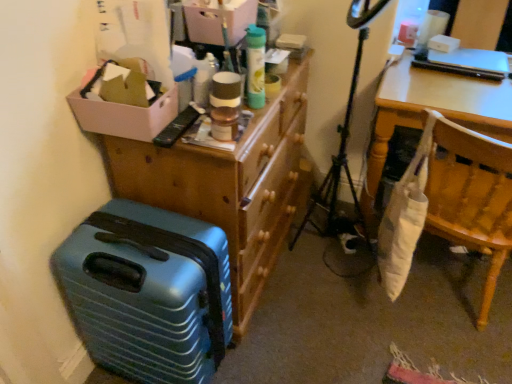
Question: Is wooden dresser at upper center smaller than matte cardboard box at upper center?

Choices:
 (A) yes
 (B) no

Answer: (B)

Question: Can you confirm if wooden dresser at upper center is shorter than matte cardboard box at upper center?

Choices:
 (A) no
 (B) yes

Answer: (A)

Question: Is there a large distance between wooden dresser at upper center and matte cardboard box at upper center?

Choices:
 (A) yes
 (B) no

Answer: (B)

Question: Is wooden dresser at upper center taller than matte cardboard box at upper center?

Choices:
 (A) yes
 (B) no

Answer: (A)

Question: From the image's perspective, is wooden dresser at upper center beneath matte cardboard box at upper center?

Choices:
 (A) yes
 (B) no

Answer: (A)

Question: Considering the positions of white fabric bag at right and white cardboard box at upper left in the image, is white fabric bag at right bigger or smaller than white cardboard box at upper left?

Choices:
 (A) small
 (B) big

Answer: (B)

Question: From the image's perspective, is white fabric bag at right positioned above or below white cardboard box at upper left?

Choices:
 (A) below
 (B) above

Answer: (A)

Question: Is white fabric bag at right situated inside white cardboard box at upper left or outside?

Choices:
 (A) outside
 (B) inside

Answer: (A)

Question: Considering the positions of point (464, 119) and point (132, 127), is point (464, 119) closer or farther from the camera than point (132, 127)?

Choices:
 (A) closer
 (B) farther

Answer: (B)

Question: Does point (377, 104) appear closer or farther from the camera than point (289, 216)?

Choices:
 (A) closer
 (B) farther

Answer: (A)

Question: From the image's perspective, is white fabric bag at right above or below wooden dresser at upper center?

Choices:
 (A) above
 (B) below

Answer: (A)

Question: Is white fabric bag at right to the left or to the right of wooden dresser at upper center in the image?

Choices:
 (A) left
 (B) right

Answer: (B)

Question: Relative to wooden dresser at upper center, is white fabric bag at right in front or behind?

Choices:
 (A) front
 (B) behind

Answer: (B)

Question: From the image's perspective, is white cardboard box at upper left above or below white fabric bag at right?

Choices:
 (A) below
 (B) above

Answer: (B)

Question: From a real-world perspective, relative to white fabric bag at right, is white cardboard box at upper left vertically above or below?

Choices:
 (A) above
 (B) below

Answer: (A)